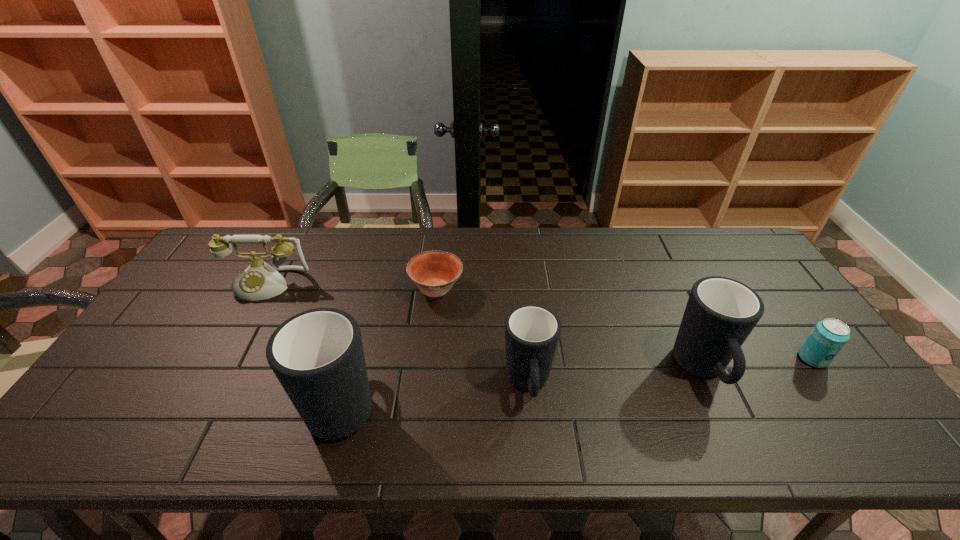
Identify the location of the leftmost mug. Image resolution: width=960 pixels, height=540 pixels. (317, 355).

Locate an element on the screen. The height and width of the screenshot is (540, 960). the fourth object from left to right is located at coordinates (532, 332).

Where is `the shortest mug`? The height and width of the screenshot is (540, 960). the shortest mug is located at coordinates (532, 332).

The image size is (960, 540). Find the location of `the second tallest object`. the second tallest object is located at coordinates (721, 312).

This screenshot has width=960, height=540. I want to click on the second tallest mug, so click(721, 312).

I want to click on the leftmost object, so click(x=260, y=281).

This screenshot has width=960, height=540. In order to click on the shortest object in this screenshot , I will do `click(434, 272)`.

Where is `the third object from left to right`? Image resolution: width=960 pixels, height=540 pixels. the third object from left to right is located at coordinates (434, 272).

In order to click on the rightmost object in this screenshot , I will do `click(828, 337)`.

The image size is (960, 540). I want to click on the fifth tallest object, so click(x=828, y=337).